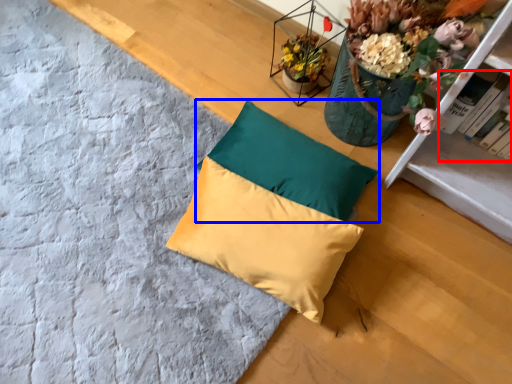
Question: Among these objects, which one is farthest to the camera, book (highlighted by a red box) or pillow (highlighted by a blue box)?

Choices:
 (A) book
 (B) pillow

Answer: (B)